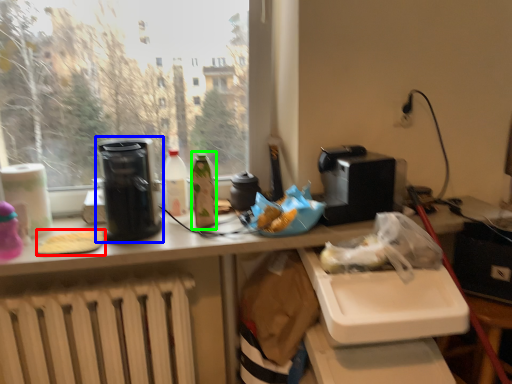
Question: Which object is positioned closest to food (highlighted by a red box)? Select from kitchen appliance (highlighted by a blue box) and bottle (highlighted by a green box).

Choices:
 (A) kitchen appliance
 (B) bottle

Answer: (A)